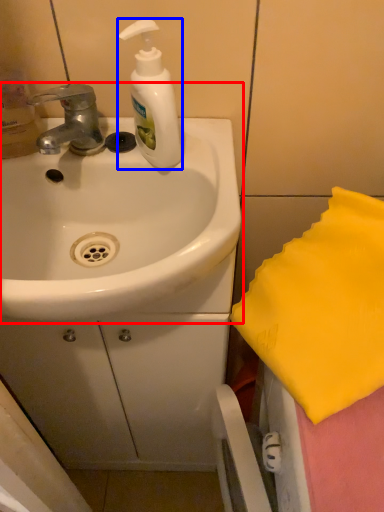
Question: Which point is further to the camera, sink (highlighted by a red box) or soap dispenser (highlighted by a blue box)?

Choices:
 (A) sink
 (B) soap dispenser

Answer: (B)